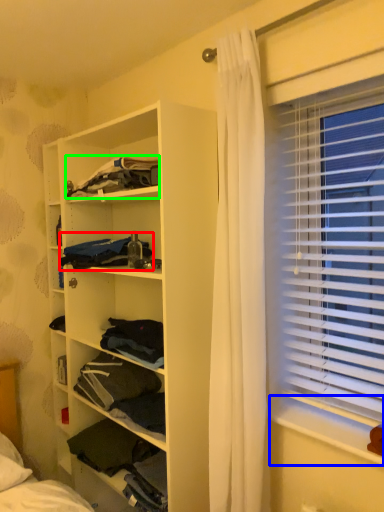
Question: Based on their relative distances, which object is nearer to clothing (highlighted by a red box)? Choose from window sill (highlighted by a blue box) and clothing (highlighted by a green box).

Choices:
 (A) window sill
 (B) clothing

Answer: (B)